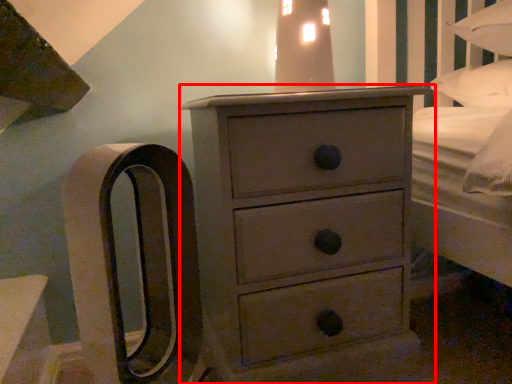
Question: In this image, where is chest of drawers (annotated by the red box) located relative to bedside lamp?

Choices:
 (A) left
 (B) right

Answer: (A)